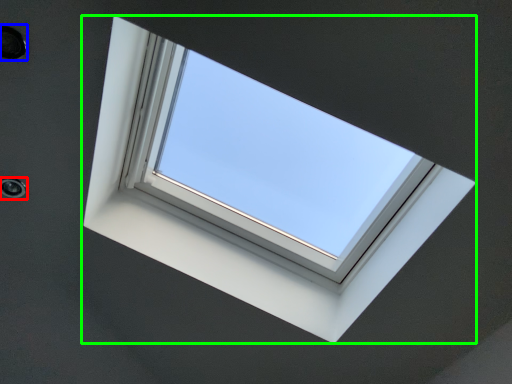
Question: Which is farther away from hole (highlighted by a red box)? hole (highlighted by a blue box) or window (highlighted by a green box)?

Choices:
 (A) hole
 (B) window

Answer: (B)